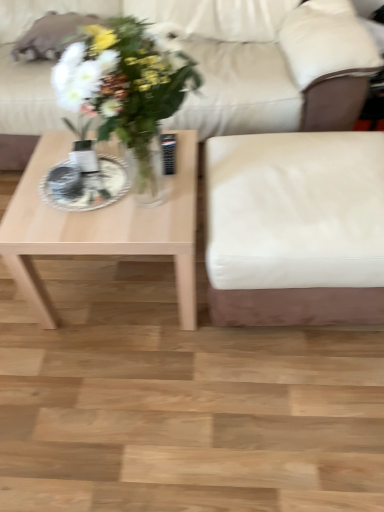
Image resolution: width=384 pixels, height=512 pixels. What are the coordinates of `free space above light wood coffee table at left (from a real-world perspective)` in the screenshot? It's located at (107, 186).